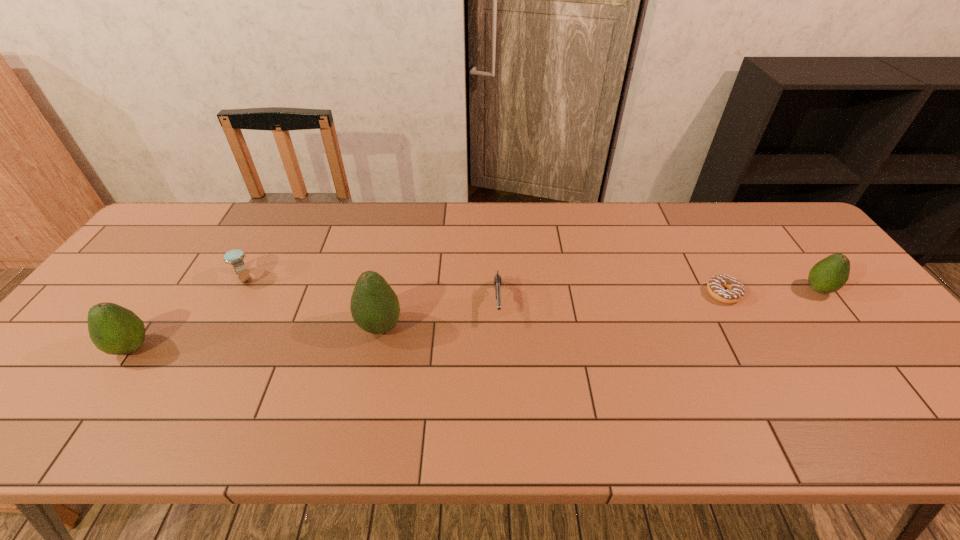
You are a GUI agent. You are given a task and a screenshot of the screen. Output one action in this format:
    pyautogui.click(x=<x>, y=<y>)
    Task: Click on the unoccupied position between the doughnut and the leftmost avocado
    This screenshot has height=540, width=960.
    Given the screenshot: What is the action you would take?
    pyautogui.click(x=427, y=321)

I want to click on vacant space in between the shortest object and the rightmost object, so click(x=771, y=292).

Find the location of `free space between the third object from left to right and the second object from right to left`. free space between the third object from left to right and the second object from right to left is located at coordinates (552, 310).

Where is `empty space between the gun and the second tallest object`? empty space between the gun and the second tallest object is located at coordinates (315, 325).

Identify which object is the fifth closest to the second avocado from right to left. Please provide its 2D coordinates. Your answer should be formatted as a tuple, i.e. [(x, y)], where the tuple contains the x and y coordinates of a point satisfying the conditions above.

[(830, 274)]

Where is `object that is the nearest to the doughnut`? Image resolution: width=960 pixels, height=540 pixels. object that is the nearest to the doughnut is located at coordinates (830, 274).

Select which avocado is the second closest to the second avocado from left to right. Please provide its 2D coordinates. Your answer should be formatted as a tuple, i.e. [(x, y)], where the tuple contains the x and y coordinates of a point satisfying the conditions above.

[(830, 274)]

Find the location of a particular element. The image size is (960, 540). avocado that stands as the closest to the leftmost avocado is located at coordinates (374, 306).

Where is `vacant space that satisfies the following two spatial constraints: 1. on the back side of the shortest object; 2. on the right side of the third object from left to right`? Image resolution: width=960 pixels, height=540 pixels. vacant space that satisfies the following two spatial constraints: 1. on the back side of the shortest object; 2. on the right side of the third object from left to right is located at coordinates (387, 294).

The image size is (960, 540). I want to click on vacant point that satisfies the following two spatial constraints: 1. on the front side of the fifth object from right to left; 2. on the left side of the shortest object, so click(236, 294).